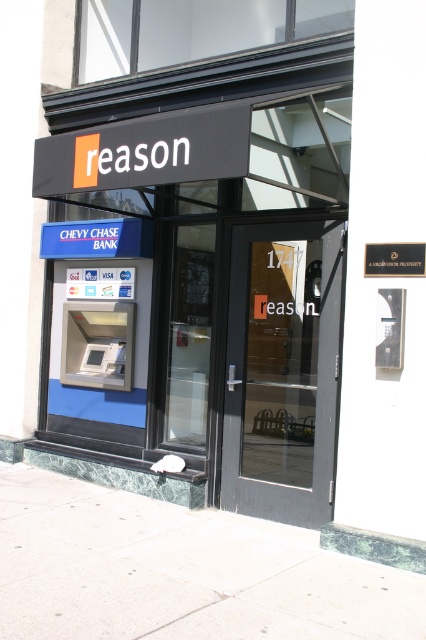
You are a delivery person with a cart that is 2 meters wide. You need to maneuver your cart through the area between the metallic atm machine at center and the gray concrete sidewalk at lower center. Can your cart fit through the space between them?

The metallic atm machine at center is narrower than the gray concrete sidewalk at lower center, so the cart that is 2 meters wide may not fit through the space between them. The width of the ATM machine is less than the sidewalk, but the available space between them might still be insufficient for a 2m cart.

You are a delivery person trying to determine if the metallic atm machine at center can fit through the matte glass door at center. Based on their heights, can it pass through?

The metallic atm machine at center is taller than the matte glass door at center, so it cannot pass through.

You are a delivery person with a package that requires a space of at least 3 meters in width to maneuver. You arrive at this building and see the gray concrete sidewalk at lower center and the matte glass door at center. Which area can accommodate your delivery vehicle?

The gray concrete sidewalk at lower center has a greater width than the matte glass door at center, so the delivery vehicle can maneuver in the gray concrete sidewalk at lower center.